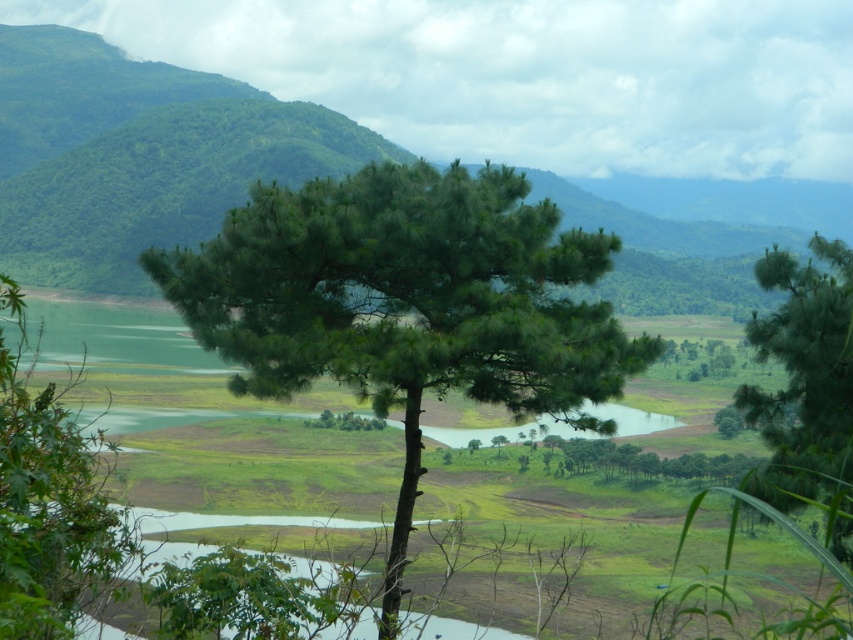
You are standing at the point with coordinates (405,304) in this landscape. What object is exactly at your current location?

The green matte tree at center is located at point (405,304).

You are a hiker trying to navigate through the landscape. You need to pass between the green matte tree at center and the green matte tree at lower left. Which tree is narrower so you can walk closer to it?

The green matte tree at center has a lesser width compared to the green matte tree at lower left, so you can walk closer to the green matte tree at center.